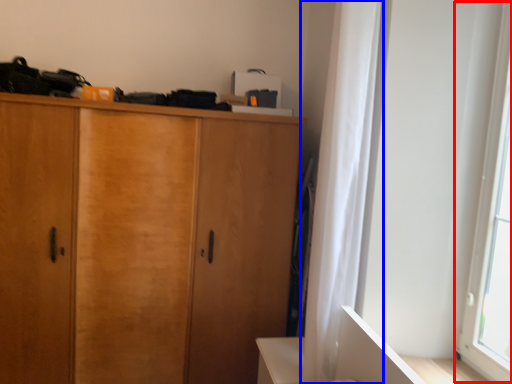
Question: Which point is closer to the camera, window screen (highlighted by a red box) or curtain (highlighted by a blue box)?

Choices:
 (A) window screen
 (B) curtain

Answer: (A)